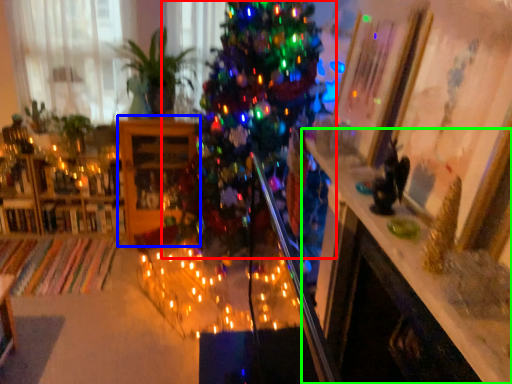
Question: Which object is positioned closest to christmas tree (highlighted by a red box)? Select from shelf (highlighted by a blue box) and table (highlighted by a green box).

Choices:
 (A) shelf
 (B) table

Answer: (A)